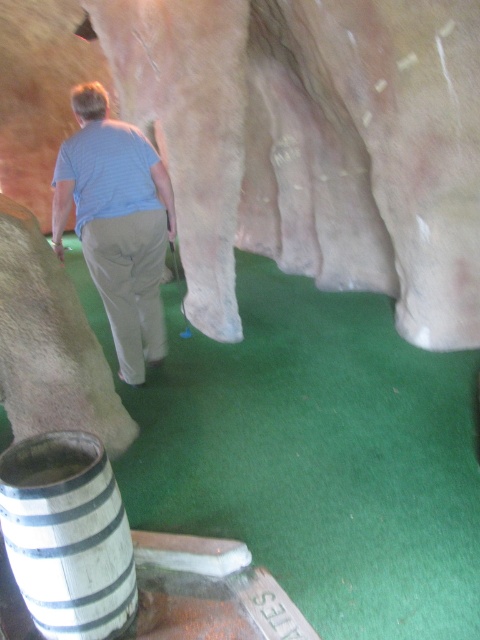
Question: Which point is closer to the camera?

Choices:
 (A) smooth beige rock at center
 (B) green artificial turf at center
 (C) wooden barrel at lower left

Answer: (C)

Question: Can you confirm if wooden barrel at lower left is bigger than light blue striped shirt at center?

Choices:
 (A) yes
 (B) no

Answer: (B)

Question: Is green artificial turf at center bigger than wooden barrel at lower left?

Choices:
 (A) yes
 (B) no

Answer: (A)

Question: Among these points, which one is farthest from the camera?

Choices:
 (A) (261, 387)
 (B) (123, 512)
 (C) (429, 163)

Answer: (A)

Question: Estimate the real-world distances between objects in this image. Which object is farther from the green artificial turf at center?

Choices:
 (A) light blue striped shirt at center
 (B) wooden barrel at lower left
 (C) smooth beige rock at center

Answer: (C)

Question: Can you confirm if wooden barrel at lower left is bigger than light blue striped shirt at center?

Choices:
 (A) no
 (B) yes

Answer: (A)